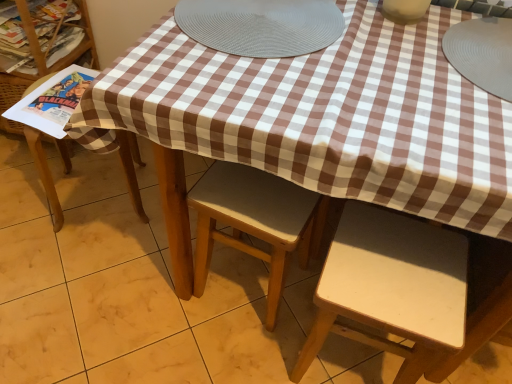
The image size is (512, 384). Identify the location of vacant space situated above wooden chair at left, which ranks as the 1th chair in left-to-right order (from a real-world perspective). (54, 97).